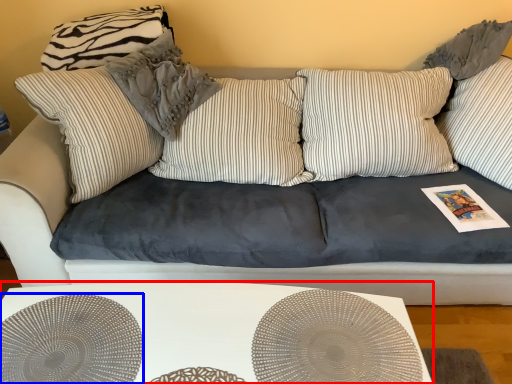
Question: Which point is further to the camera, table (highlighted by a red box) or circle (highlighted by a blue box)?

Choices:
 (A) table
 (B) circle

Answer: (A)